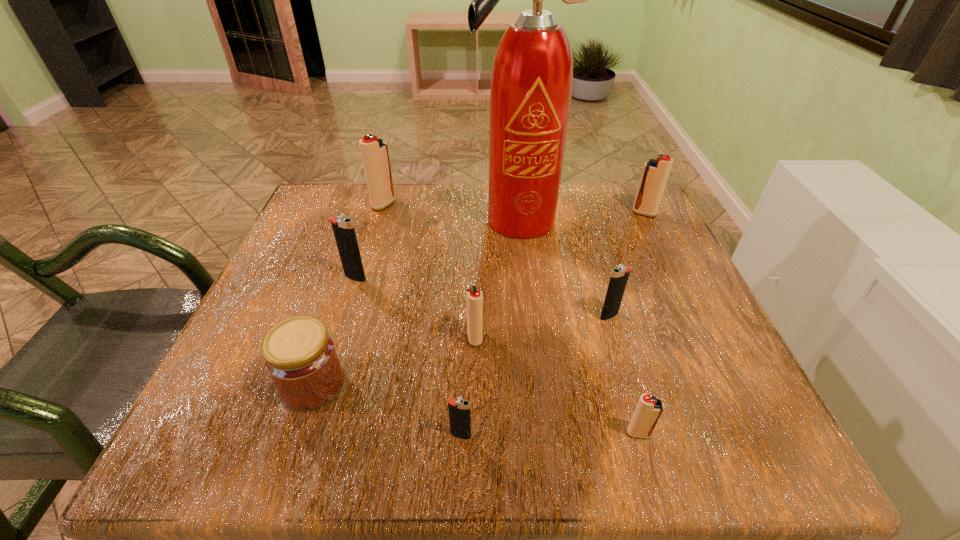
Point out which object is positioned as the fifth nearest to the rightmost object. Please provide its 2D coordinates. Your answer should be formatted as a tuple, i.e. [(x, y)], where the tuple contains the x and y coordinates of a point satisfying the conditions above.

[(374, 151)]

The height and width of the screenshot is (540, 960). What are the coordinates of `igniter that is the second closest one to the second black igniter from left to right` in the screenshot? It's located at (649, 409).

You are a GUI agent. You are given a task and a screenshot of the screen. Output one action in this format:
    pyautogui.click(x=<x>, y=<y>)
    Task: Click on the igniter that is the second closest to the rightmost black igniter
    This screenshot has height=540, width=960.
    Given the screenshot: What is the action you would take?
    pyautogui.click(x=474, y=297)

The image size is (960, 540). Find the location of `the closest red igniter to the nearest red igniter`. the closest red igniter to the nearest red igniter is located at coordinates (474, 297).

Where is `the closest red igniter to the second biggest red igniter`? The image size is (960, 540). the closest red igniter to the second biggest red igniter is located at coordinates (474, 297).

Point out which black igniter is positioned as the nearest to the fourth farthest object. Please provide its 2D coordinates. Your answer should be formatted as a tuple, i.e. [(x, y)], where the tuple contains the x and y coordinates of a point satisfying the conditions above.

[(459, 409)]

Select which black igniter is the closest to the leftmost black igniter. Please provide its 2D coordinates. Your answer should be formatted as a tuple, i.e. [(x, y)], where the tuple contains the x and y coordinates of a point satisfying the conditions above.

[(459, 409)]

Where is `free region that satisfies the following two spatial constraints: 1. on the back side of the jam; 2. on the left side of the farthest black igniter`? free region that satisfies the following two spatial constraints: 1. on the back side of the jam; 2. on the left side of the farthest black igniter is located at coordinates (348, 278).

At what (x,y) coordinates should I click in order to perform the action: click on free region that satisfies the following two spatial constraints: 1. on the front side of the smallest red igniter; 2. on the right side of the leftmost red igniter. Please return your answer as a coordinate pair (x, y). This screenshot has width=960, height=540. Looking at the image, I should click on (316, 434).

Identify the location of blank space that satisfies the following two spatial constraints: 1. on the back side of the sixth farthest object; 2. on the left side of the fire extinguisher. click(476, 220).